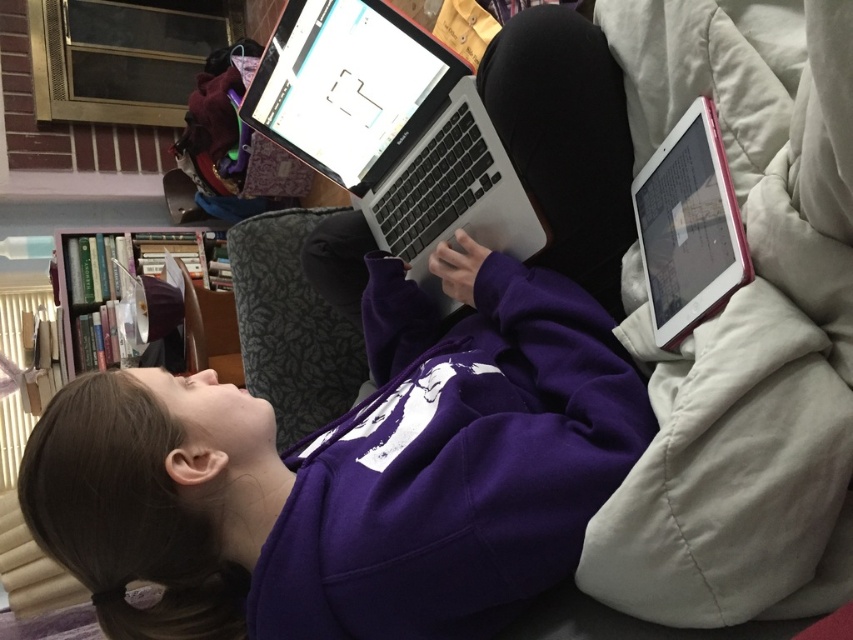
Question: Does silver metallic laptop at center appear on the left side of wooden bookshelf at left?

Choices:
 (A) no
 (B) yes

Answer: (A)

Question: Considering the real-world distances, which object is farthest from the silver metallic laptop at center?

Choices:
 (A) purple fleece sweatshirt at center
 (B) wooden bookshelf at left
 (C) pink plastic tablet at upper right

Answer: (B)

Question: Can you confirm if purple fleece sweatshirt at center is bigger than pink plastic tablet at upper right?

Choices:
 (A) no
 (B) yes

Answer: (B)

Question: Which is farther from the purple fleece sweatshirt at center?

Choices:
 (A) pink plastic tablet at upper right
 (B) wooden bookshelf at left
 (C) silver metallic laptop at center

Answer: (B)

Question: Can you confirm if purple fleece sweatshirt at center is positioned below silver metallic laptop at center?

Choices:
 (A) yes
 (B) no

Answer: (A)

Question: Which object is farther from the camera taking this photo?

Choices:
 (A) purple fleece sweatshirt at center
 (B) wooden bookshelf at left
 (C) silver metallic laptop at center
 (D) pink plastic tablet at upper right

Answer: (B)